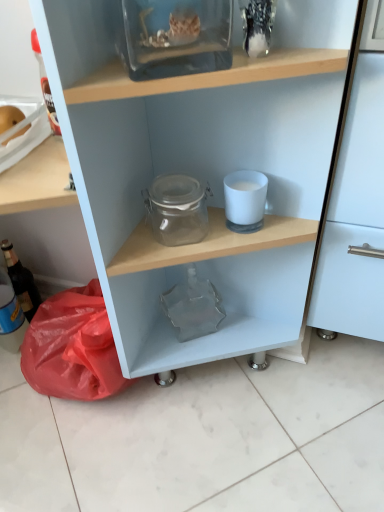
Question: Is transparent glass jar at center bigger than matte glass bottle at left?

Choices:
 (A) no
 (B) yes

Answer: (B)

Question: Is transparent glass jar at center facing away from matte glass bottle at left?

Choices:
 (A) yes
 (B) no

Answer: (A)

Question: Is transparent glass jar at center positioned beyond the bounds of matte glass bottle at left?

Choices:
 (A) no
 (B) yes

Answer: (B)

Question: Is transparent glass jar at center smaller than matte glass bottle at left?

Choices:
 (A) yes
 (B) no

Answer: (B)

Question: Considering the relative sizes of transparent glass jar at center and matte glass bottle at left in the image provided, is transparent glass jar at center taller than matte glass bottle at left?

Choices:
 (A) yes
 (B) no

Answer: (A)

Question: Does transparent glass jar at center have a greater width compared to matte glass bottle at left?

Choices:
 (A) yes
 (B) no

Answer: (A)

Question: Does transparent glass jar at center have a lesser height compared to matte glass bottle at left?

Choices:
 (A) yes
 (B) no

Answer: (A)

Question: Considering the relative sizes of transparent glass jar at center and matte glass bottle at left in the image provided, is transparent glass jar at center wider than matte glass bottle at left?

Choices:
 (A) yes
 (B) no

Answer: (A)

Question: From the image's perspective, is transparent glass jar at center over matte glass bottle at left?

Choices:
 (A) no
 (B) yes

Answer: (B)

Question: Is transparent glass jar at center not close to matte glass bottle at left?

Choices:
 (A) yes
 (B) no

Answer: (B)

Question: From a real-world perspective, is transparent glass jar at center physically below matte glass bottle at left?

Choices:
 (A) yes
 (B) no

Answer: (B)

Question: Is the depth of transparent glass jar at center less than that of matte glass bottle at left?

Choices:
 (A) yes
 (B) no

Answer: (A)

Question: Would you say transparent glass jar at upper center is a long distance from matte glass bottle at left?

Choices:
 (A) no
 (B) yes

Answer: (A)